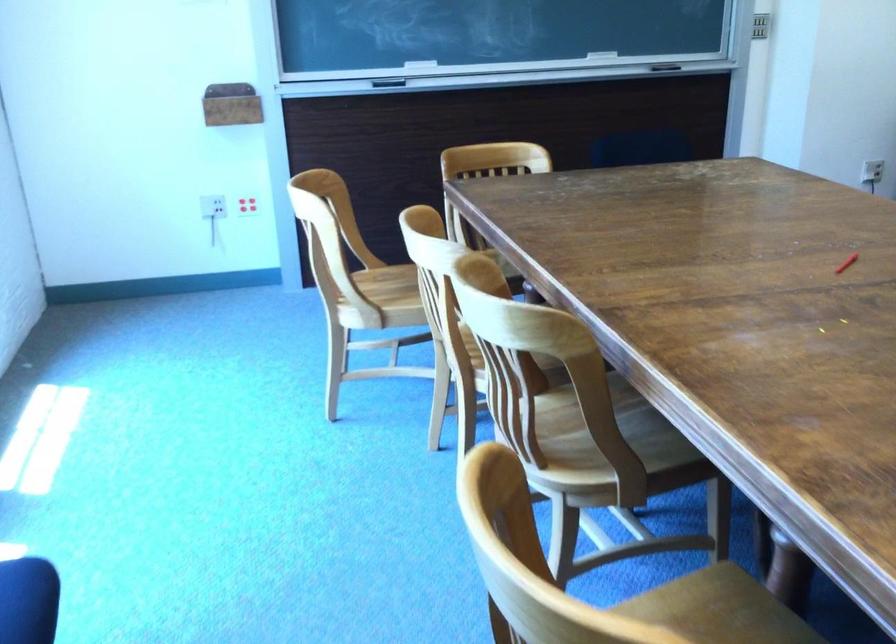
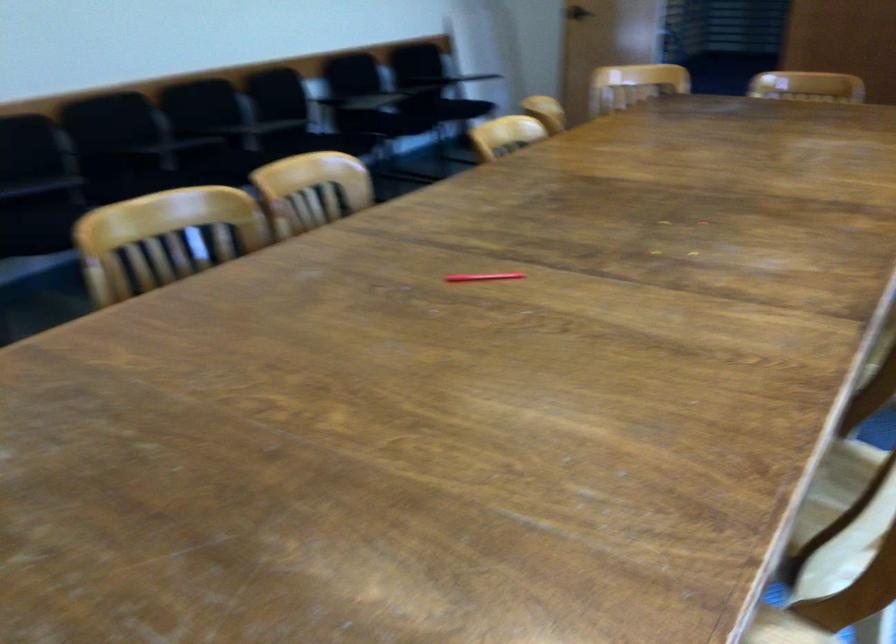
Locate, in the second image, the point that corresponds to the point at 815,269 in the first image.

(486, 279)